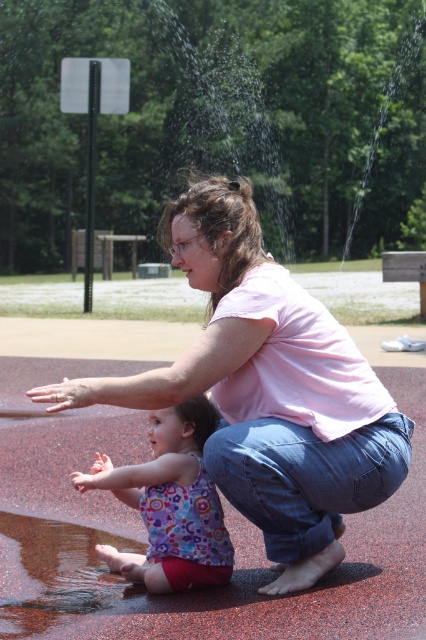
Is pink cotton shirt at center bigger than floral tank top at center?

Correct, pink cotton shirt at center is larger in size than floral tank top at center.

Does point (282, 310) lie behind point (210, 429)?

No.

Locate an element on the screen. This screenshot has height=640, width=426. pink cotton shirt at center is located at coordinates (267, 388).

Where is `pink cotton shirt at center`? This screenshot has height=640, width=426. pink cotton shirt at center is located at coordinates (267, 388).